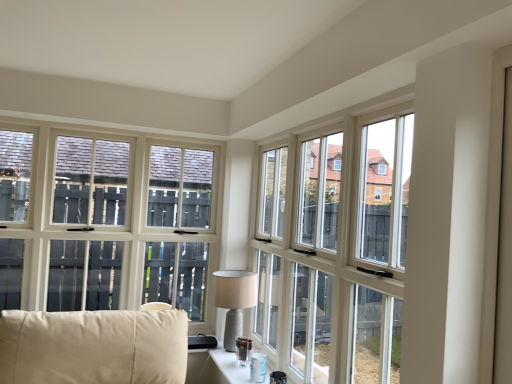
Question: From a real-world perspective, is transparent glass window at center positioned over clear glass table at lower center based on gravity?

Choices:
 (A) no
 (B) yes

Answer: (B)

Question: From the image's perspective, would you say transparent glass window at center is shown under clear glass table at lower center?

Choices:
 (A) no
 (B) yes

Answer: (A)

Question: Is transparent glass window at center at the left side of clear glass table at lower center?

Choices:
 (A) no
 (B) yes

Answer: (A)

Question: From a real-world perspective, is transparent glass window at center located beneath clear glass table at lower center?

Choices:
 (A) no
 (B) yes

Answer: (A)

Question: Can you confirm if transparent glass window at center is thinner than clear glass table at lower center?

Choices:
 (A) no
 (B) yes

Answer: (B)

Question: Considering the positions of matte gray lamp at center and transparent glass window at center in the image, is matte gray lamp at center wider or thinner than transparent glass window at center?

Choices:
 (A) wide
 (B) thin

Answer: (A)

Question: In terms of size, does matte gray lamp at center appear bigger or smaller than transparent glass window at center?

Choices:
 (A) big
 (B) small

Answer: (B)

Question: From a real-world perspective, is matte gray lamp at center above or below transparent glass window at center?

Choices:
 (A) above
 (B) below

Answer: (B)

Question: Is matte gray lamp at center taller or shorter than transparent glass window at center?

Choices:
 (A) short
 (B) tall

Answer: (A)

Question: From a real-world perspective, is clear glass table at lower center positioned above or below matte gray lamp at center?

Choices:
 (A) above
 (B) below

Answer: (B)

Question: Is clear glass table at lower center situated inside matte gray lamp at center or outside?

Choices:
 (A) inside
 (B) outside

Answer: (B)

Question: Is point (227, 352) positioned closer to the camera than point (241, 317)?

Choices:
 (A) closer
 (B) farther

Answer: (A)

Question: Is clear glass table at lower center wider or thinner than matte gray lamp at center?

Choices:
 (A) wide
 (B) thin

Answer: (B)

Question: Considering the positions of point (238, 307) and point (227, 370), is point (238, 307) closer or farther from the camera than point (227, 370)?

Choices:
 (A) closer
 (B) farther

Answer: (B)

Question: Based on their sizes in the image, would you say matte gray lamp at center is bigger or smaller than clear glass table at lower center?

Choices:
 (A) small
 (B) big

Answer: (B)